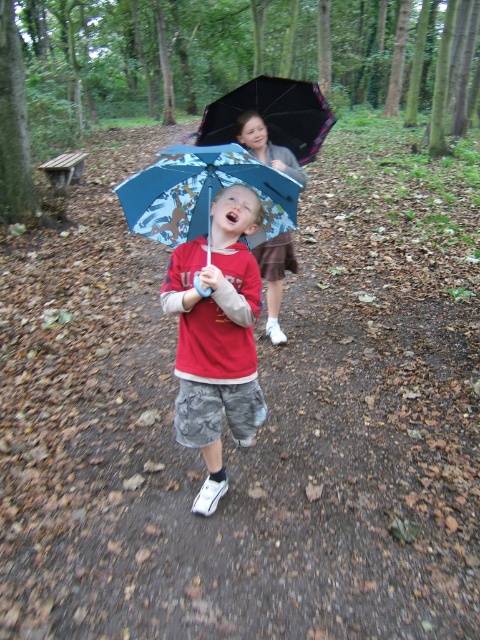
Between camouflage shorts at center and blue fabric umbrella at center, which one has less height?

blue fabric umbrella at center is shorter.

Can you confirm if camouflage shorts at center is positioned to the left of blue fabric umbrella at center?

Yes, camouflage shorts at center is to the left of blue fabric umbrella at center.

This screenshot has width=480, height=640. Describe the element at coordinates (216, 337) in the screenshot. I see `camouflage shorts at center` at that location.

Identify the location of camouflage shorts at center. (216, 337).

Can you confirm if blue fabric umbrella at center is bigger than matte blue umbrella at center?

No, blue fabric umbrella at center is not bigger than matte blue umbrella at center.

Is blue fabric umbrella at center shorter than matte blue umbrella at center?

Yes.

Where is `blue fabric umbrella at center`? Image resolution: width=480 pixels, height=640 pixels. blue fabric umbrella at center is located at coordinates (204, 195).

In order to click on blue fabric umbrella at center in this screenshot , I will do click(x=204, y=195).

Is point (180, 358) less distant than point (276, 148)?

That is True.

From the picture: Is camouflage shorts at center to the left of matte blue umbrella at center from the viewer's perspective?

Yes, camouflage shorts at center is to the left of matte blue umbrella at center.

Who is more forward, (204, 284) or (276, 324)?

Point (204, 284) is more forward.

At what (x,y) coordinates should I click in order to perform the action: click on camouflage shorts at center. Please return your answer as a coordinate pair (x, y). The width and height of the screenshot is (480, 640). Looking at the image, I should click on (216, 337).